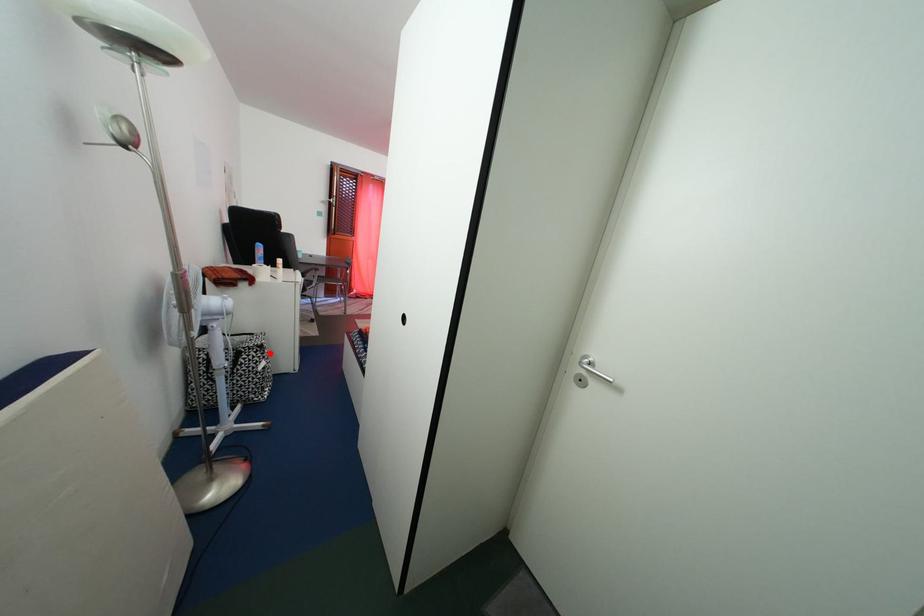
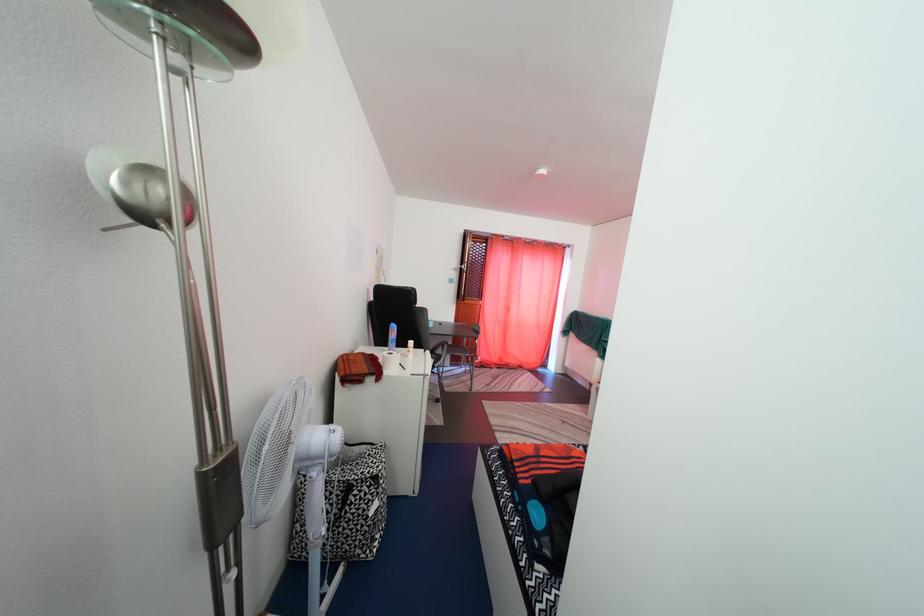
Question: I am providing you with two images of the same scene from different viewpoints. In image1, a red point is highlighted. Considering the same 3D point in image2, which of the following is correct?

Choices:
 (A) It is closer
 (B) It is farther

Answer: (B)